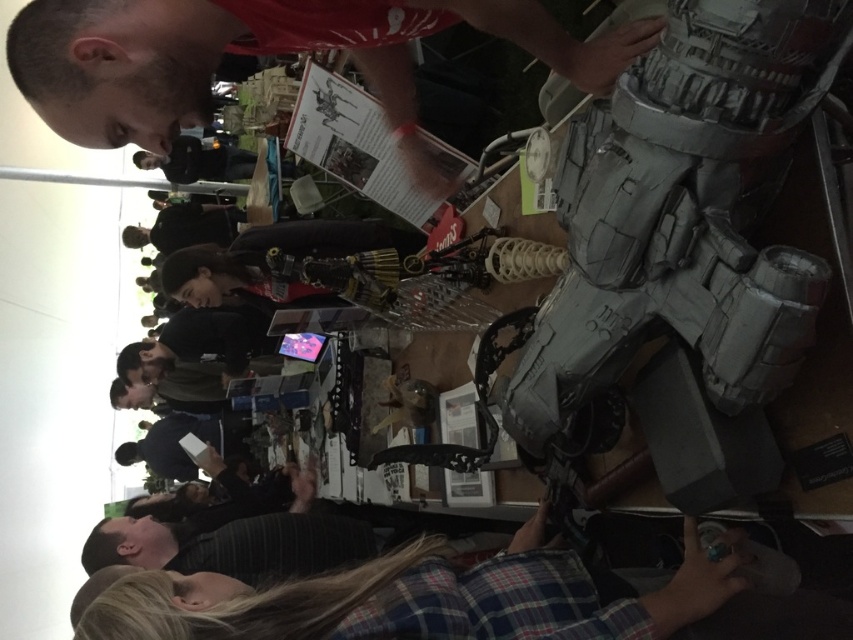
Question: Is matte gray helmet at upper right positioned in front of plaid fabric shirt at lower center?

Choices:
 (A) yes
 (B) no

Answer: (A)

Question: Which point is farther from the camera taking this photo?

Choices:
 (A) (674, 614)
 (B) (526, 10)

Answer: (B)

Question: Does matte gray helmet at upper right appear on the right side of plaid fabric shirt at lower center?

Choices:
 (A) yes
 (B) no

Answer: (A)

Question: Which point appears farthest from the camera in this image?

Choices:
 (A) (492, 593)
 (B) (45, 80)

Answer: (A)

Question: Is matte gray helmet at upper right wider than plaid fabric shirt at lower center?

Choices:
 (A) no
 (B) yes

Answer: (A)